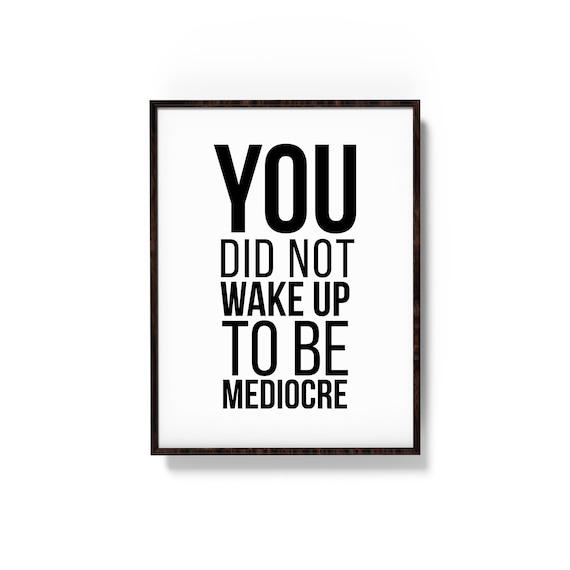
Locate an element on the screen. frame is located at coordinates (416, 289).